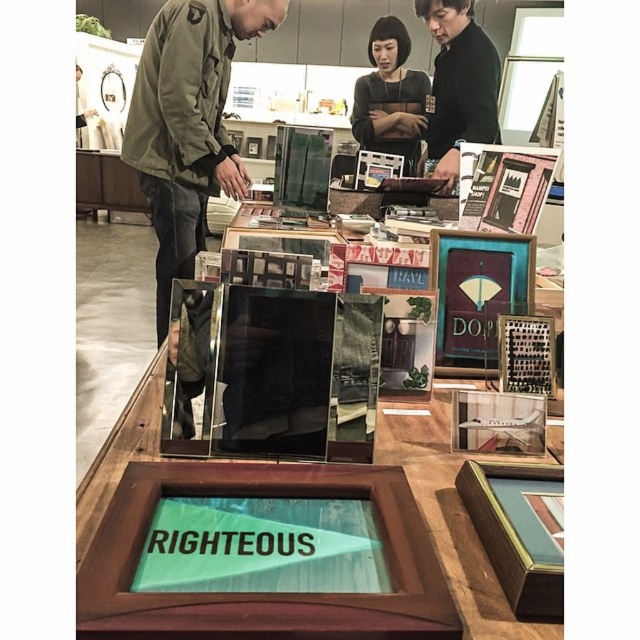
Is the position of black matte jacket at upper center less distant than that of black mesh top at center?

Yes, it is in front of black mesh top at center.

Does black matte jacket at upper center appear under black mesh top at center?

Indeed, black matte jacket at upper center is positioned under black mesh top at center.

Does point (438, 106) come closer to viewer compared to point (424, 76)?

Yes.

The height and width of the screenshot is (640, 640). Find the location of `black matte jacket at upper center`. black matte jacket at upper center is located at coordinates (458, 84).

Can you confirm if green matte jacket at center is wider than black matte jacket at upper center?

Yes, green matte jacket at center is wider than black matte jacket at upper center.

Looking at this image, does green matte jacket at center have a greater height compared to black matte jacket at upper center?

Indeed, green matte jacket at center has a greater height compared to black matte jacket at upper center.

What do you see at coordinates (188, 124) in the screenshot? I see `green matte jacket at center` at bounding box center [188, 124].

Where is `green matte jacket at center`? This screenshot has height=640, width=640. green matte jacket at center is located at coordinates (188, 124).

Between green matte jacket at center and black mesh top at center, which one appears on the right side from the viewer's perspective?

From the viewer's perspective, black mesh top at center appears more on the right side.

Between green matte jacket at center and black mesh top at center, which one has less height?

Standing shorter between the two is black mesh top at center.

Identify the location of green matte jacket at center. (188, 124).